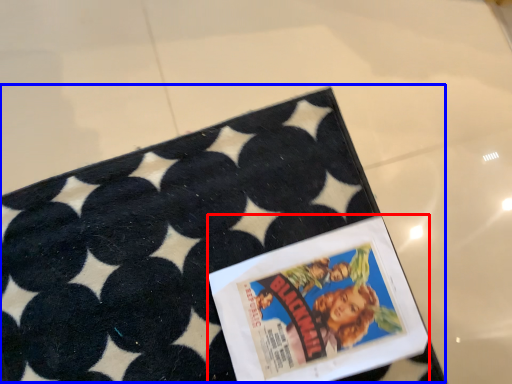
Question: Among these objects, which one is nearest to the camera, comic book (highlighted by a red box) or tray (highlighted by a blue box)?

Choices:
 (A) comic book
 (B) tray

Answer: (B)